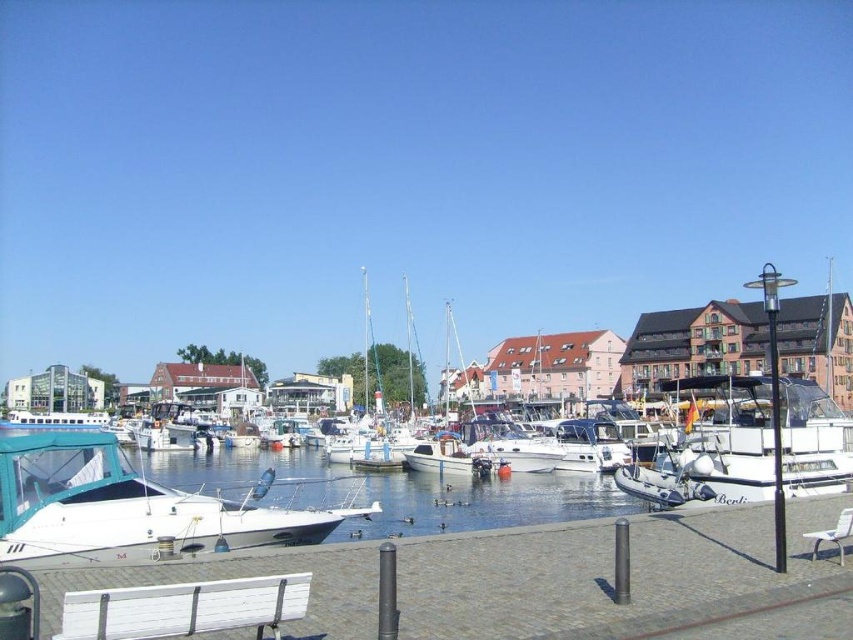
You are standing at the edge of the marina and want to visit a point that is 260.83 feet away from you. Is the point at point coordinates point (302, 480) within the marina scene? Please explain your reasoning.

Yes, the point at point coordinates point (302, 480) is within the marina scene because the distance from the viewer is exactly 260.83 feet as specified.

You are planning to place a decorative planter on the walkway between the white wood bench at lower left and the white glossy sailboat at center. Based on their widths, which object should the planter be placed closer to?

The white wood bench at lower left has a lesser width compared to the white glossy sailboat at center, so the planter should be placed closer to the white wood bench at lower left to ensure proper spacing.

You are standing on the cobblestone walkway and want to reach the water at the marina. According to the coordinates provided, where exactly is the white matte water at center located?

The white matte water at center is located at point 0.769 on the x axis and 0.457 on the y axis.